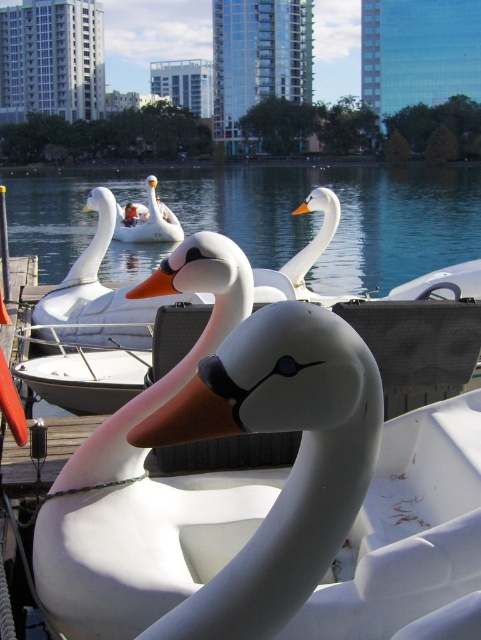
You are standing at the wooden pier and want to locate two specific points. The first point is at coordinates point (137, 307) and the second point is at point (153, 291). Which point is closer to you?

Point (153, 291) is closer to you because it is in front of point (137, 307).

Based on the photo, you are planning to take a photo of the clear blue water at center and the orange matte beak at upper center. Since you want both subjects to be clearly visible in the frame, which one should you focus on to ensure the wider subject is sharp?

You should focus on the clear blue water at center because its width is larger than the orange matte beak at upper center, so focusing on the wider subject will help ensure both are sharp.

You are a photographer standing on the wooden pier and want to capture both the clear blue water at center and the orange matte beak at upper center in your photo. Which object should you focus on first to ensure both are in the frame?

You should focus on the clear blue water at center first because it is in front of the orange matte beak at upper center, so by framing the water, the beak will naturally be included in the background.